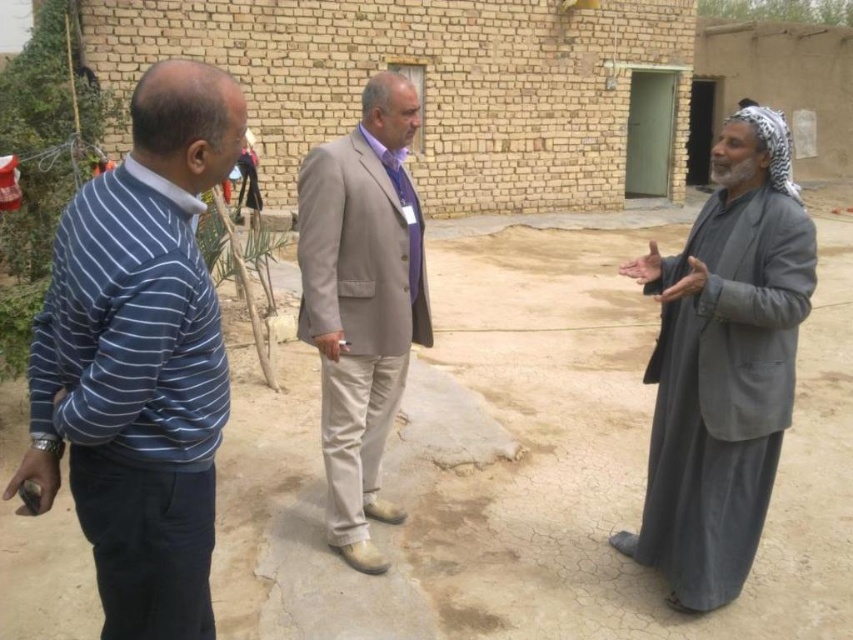
You are a photographer trying to capture a clear shot of the beige fabric suit at center while avoiding the gray woolen robe at right. Based on their positions, can you tell me if the robe is blocking the suit or if the suit is blocking the robe?

The gray woolen robe at right is positioned under the beige fabric suit at center, so the beige fabric suit at center is blocking the gray woolen robe at right. Therefore, the robe is not blocking the suit, but the suit is blocking the robe.

You are a tailor observing two garments in a rural scene. The gray woolen robe at right and the beige fabric suit at center. Which garment is shorter in height?

The gray woolen robe at right has a lesser height compared to the beige fabric suit at center, so the gray woolen robe at right is shorter in height.

Based on the photo, you are a photographer standing at the right side of the scene. You want to take a photo that includes both the blue striped sweater at left and the beige fabric suit at center. What is the minimum distance you need to move to the left to ensure both subjects are in frame?

The minimum distance you need to move to the left is 0.605 meters. This is because the two subjects are 1.21 meters apart, so moving halfway between them would allow both to be captured in the frame.